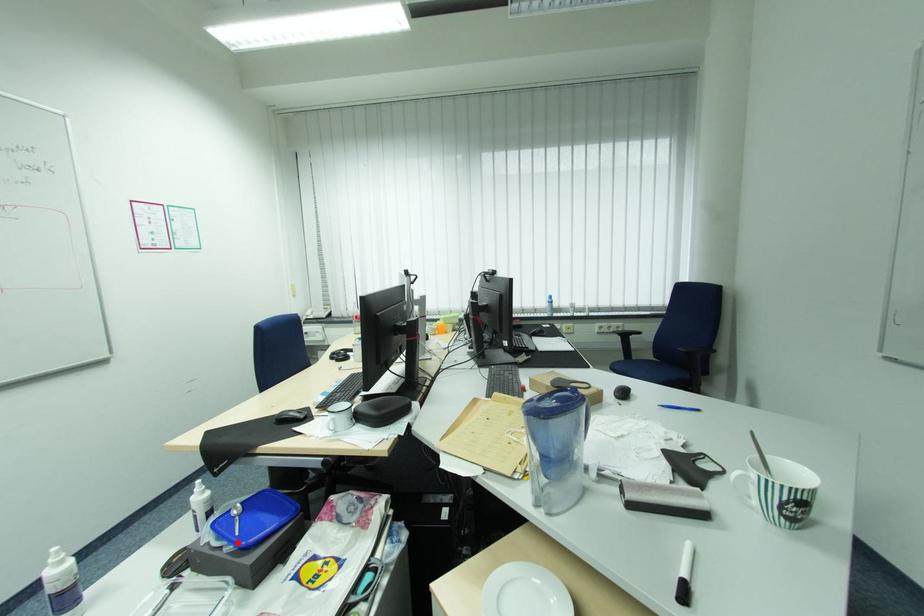
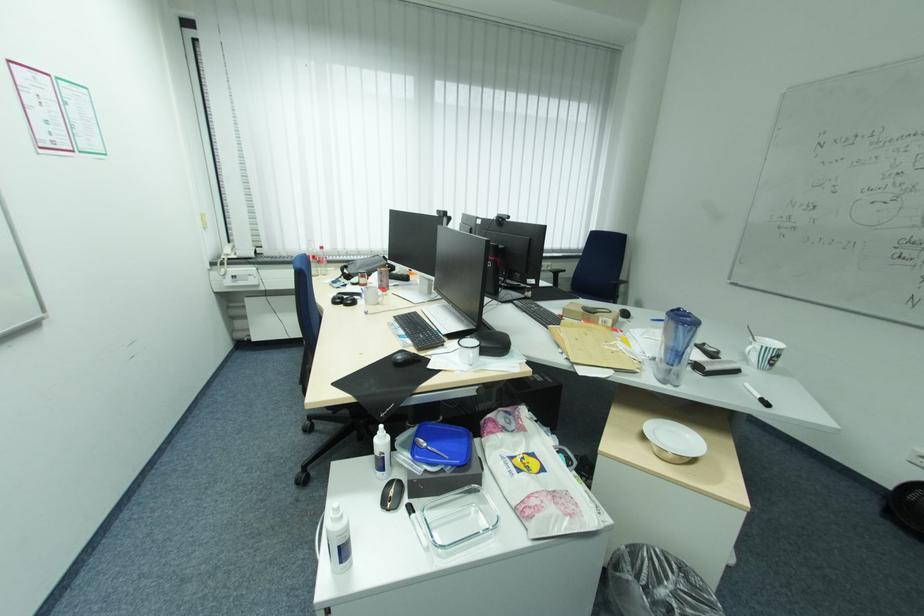
In the second image, find the point that corresponds to the highlighted location in the first image.

(454, 464)